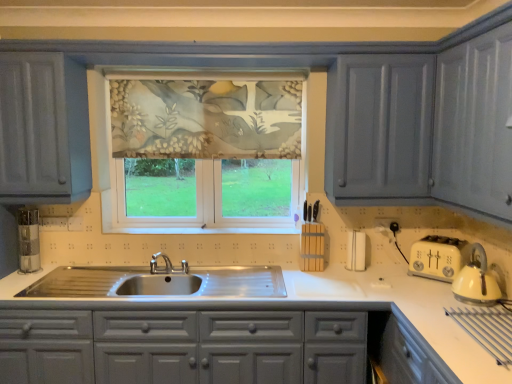
Question: From a real-world perspective, is floral fabric window at center above or below white glossy countertop at center?

Choices:
 (A) below
 (B) above

Answer: (B)

Question: Is floral fabric window at center taller or shorter than white glossy countertop at center?

Choices:
 (A) short
 (B) tall

Answer: (B)

Question: In terms of size, does floral fabric window at center appear bigger or smaller than white glossy countertop at center?

Choices:
 (A) big
 (B) small

Answer: (B)

Question: Considering the positions of point (493, 370) and point (180, 205), is point (493, 370) closer or farther from the camera than point (180, 205)?

Choices:
 (A) farther
 (B) closer

Answer: (B)

Question: In the image, is white glossy countertop at center positioned in front of or behind floral fabric window at center?

Choices:
 (A) front
 (B) behind

Answer: (A)

Question: Is white glossy countertop at center wider or thinner than floral fabric window at center?

Choices:
 (A) wide
 (B) thin

Answer: (A)

Question: From a real-world perspective, is white glossy countertop at center physically located above or below floral fabric window at center?

Choices:
 (A) below
 (B) above

Answer: (A)